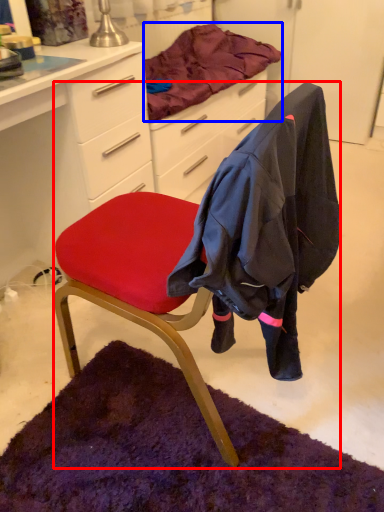
Question: Which of the following is the closest to the observer, chair (highlighted by a red box) or blanket (highlighted by a blue box)?

Choices:
 (A) chair
 (B) blanket

Answer: (A)